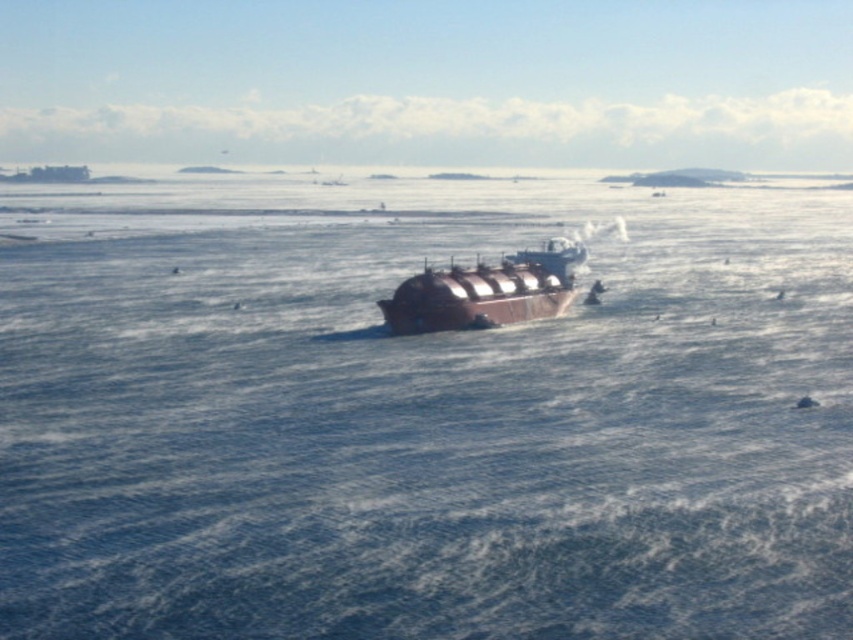
Question: Is brown metallic water at center in front of brown matte tanker at center?

Choices:
 (A) yes
 (B) no

Answer: (A)

Question: Which object is closer to the camera taking this photo?

Choices:
 (A) brown matte tanker at center
 (B) brown metallic water at center

Answer: (B)

Question: Does brown metallic water at center appear under brown matte tanker at center?

Choices:
 (A) no
 (B) yes

Answer: (A)

Question: Considering the relative positions of brown metallic water at center and brown matte tanker at center in the image provided, where is brown metallic water at center located with respect to brown matte tanker at center?

Choices:
 (A) below
 (B) above

Answer: (B)